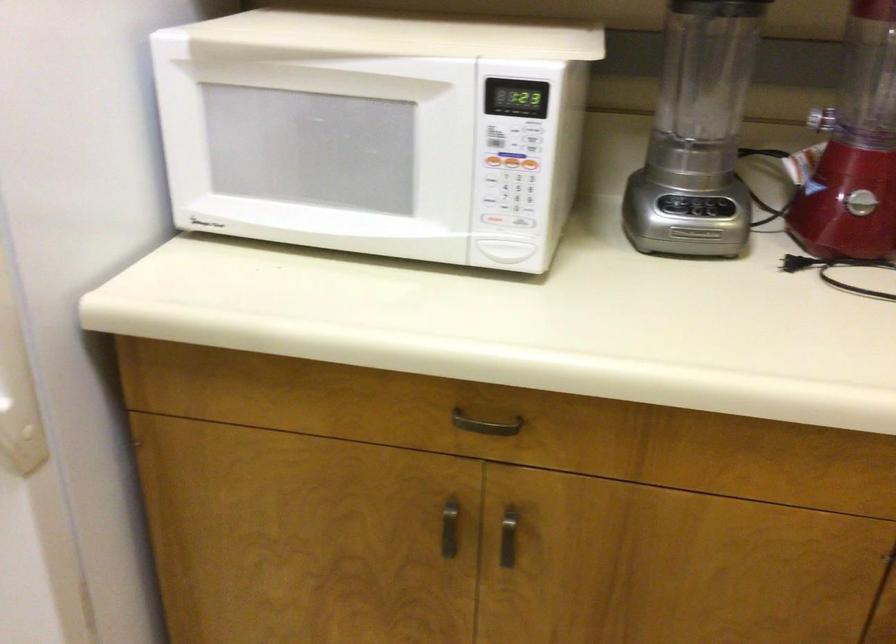
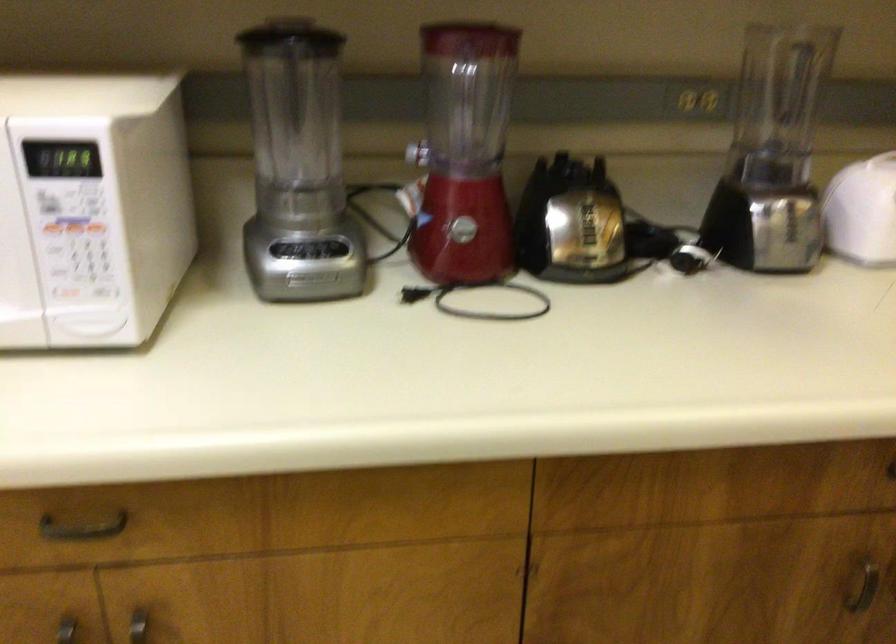
In the second image, find the point that corresponds to [698,205] in the first image.

(308, 249)